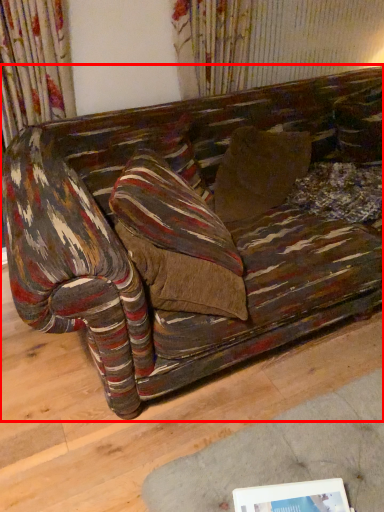
Question: From the image's perspective, considering the relative positions of studio couch (annotated by the red box) and picture frame in the image provided, where is studio couch (annotated by the red box) located with respect to the staircase?

Choices:
 (A) above
 (B) below

Answer: (A)